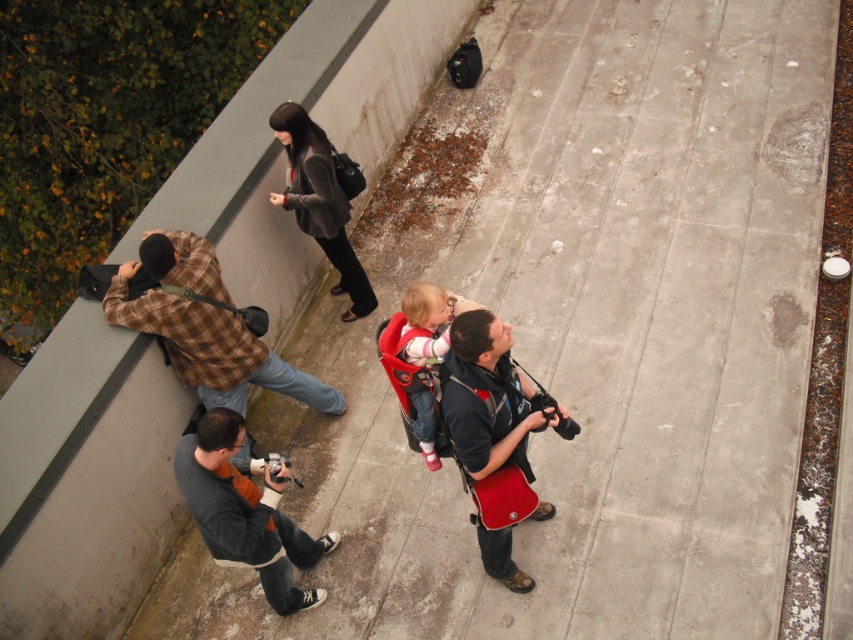
Is the position of concrete ledge at upper left less distant than that of matte pink baby carrier at center?

No, it is not.

Where is `concrete ledge at upper left`? This screenshot has height=640, width=853. concrete ledge at upper left is located at coordinates (86, 480).

Measure the distance between brown plaid shirt at left and camera.

The distance of brown plaid shirt at left from camera is 5.00 meters.

Does brown plaid shirt at left have a larger size compared to matte pink baby carrier at center?

Yes.

Is point (184, 360) behind point (448, 312)?

Yes, point (184, 360) is farther from viewer.

This screenshot has height=640, width=853. What are the coordinates of `brown plaid shirt at left` in the screenshot? It's located at (206, 326).

Is point (195, 372) closer to camera compared to point (514, 365)?

No, it is not.

What do you see at coordinates (206, 326) in the screenshot?
I see `brown plaid shirt at left` at bounding box center [206, 326].

Image resolution: width=853 pixels, height=640 pixels. In order to click on brown plaid shirt at left in this screenshot , I will do `click(206, 326)`.